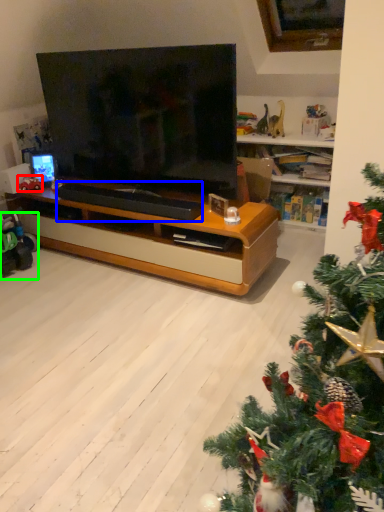
Question: Which object is positioned closest to toy (highlighted by a red box)? Select from footrest (highlighted by a blue box) and toy (highlighted by a green box).

Choices:
 (A) footrest
 (B) toy

Answer: (B)